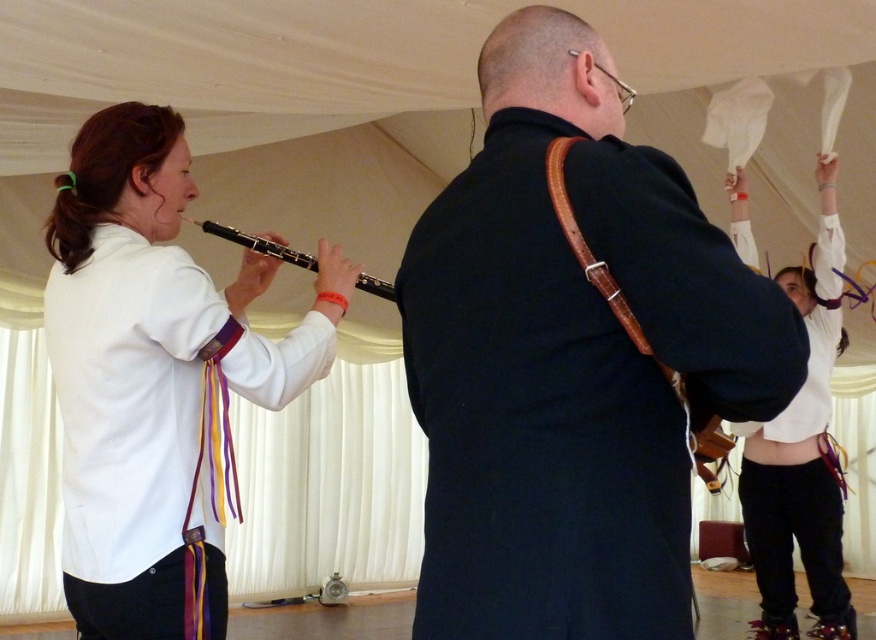
You are organizing a small musical performance in the tented space. You need to place a 1.2 meter wide decorative panel between the dark blue jacket at center and the white matte flute at left. Is there enough space between them to fit the panel?

The dark blue jacket at center has a lesser width compared to white matte flute at left. The combined width of both objects is not specified, but since the panel requires 1.2 meters, it depends on the actual spacing between them. However, based on the given information, we cannot confirm if the space is sufficient.

You are organizing a small performance and need to place two items on a shelf. The dark blue jacket at center and the black wood flute at left must be arranged so that the one taking up more space is on the right. Which object should you place on the right side of the shelf?

The black wood flute at left should be placed on the right side of the shelf because it occupies more space than the dark blue jacket at center.